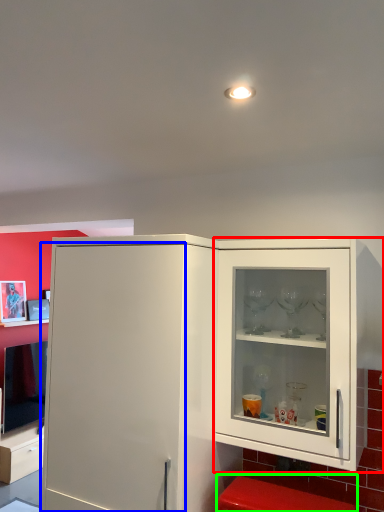
Question: Which object is positioned closest to cupboard (highlighted by a red box)? Select from door (highlighted by a blue box) and step stool (highlighted by a green box).

Choices:
 (A) door
 (B) step stool

Answer: (B)